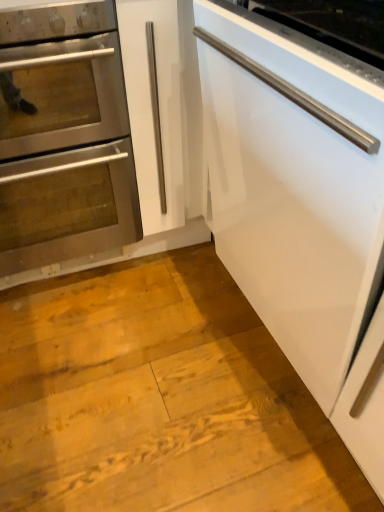
Where is `stainless steel oven at left`? The width and height of the screenshot is (384, 512). stainless steel oven at left is located at coordinates (63, 137).

The image size is (384, 512). What do you see at coordinates (63, 137) in the screenshot?
I see `stainless steel oven at left` at bounding box center [63, 137].

Where is `white glossy dishwasher at right`? This screenshot has height=512, width=384. white glossy dishwasher at right is located at coordinates (301, 206).

The image size is (384, 512). What do you see at coordinates (301, 206) in the screenshot?
I see `white glossy dishwasher at right` at bounding box center [301, 206].

Measure the distance between point (356,248) and camera.

The depth of point (356,248) is 24.69 inches.

Locate an element on the screen. stainless steel oven at left is located at coordinates (63, 137).

Is stainless steel oven at left at the left side of white glossy dishwasher at right?

Yes.

Is the position of stainless steel oven at left less distant than that of white glossy dishwasher at right?

No, it is not.

Which is in front, point (107, 231) or point (268, 120)?

The point (268, 120) is closer to the camera.

From the image's perspective, which object appears higher, stainless steel oven at left or white glossy dishwasher at right?

stainless steel oven at left.

From a real-world perspective, does stainless steel oven at left sit lower than white glossy dishwasher at right?

Indeed, from a real-world perspective, stainless steel oven at left is positioned beneath white glossy dishwasher at right.

Between stainless steel oven at left and white glossy dishwasher at right, which one has larger width?

Wider between the two is stainless steel oven at left.

Is stainless steel oven at left shorter than white glossy dishwasher at right?

Incorrect, the height of stainless steel oven at left does not fall short of that of white glossy dishwasher at right.

Can you confirm if stainless steel oven at left is smaller than white glossy dishwasher at right?

Yes, stainless steel oven at left is smaller than white glossy dishwasher at right.

Is stainless steel oven at left located outside white glossy dishwasher at right?

That's correct, stainless steel oven at left is outside of white glossy dishwasher at right.

Is the surface of stainless steel oven at left in direct contact with white glossy dishwasher at right?

No, stainless steel oven at left is not next to white glossy dishwasher at right.

Is white glossy dishwasher at right at the back of stainless steel oven at left?

No.

How many degrees apart are the facing directions of stainless steel oven at left and white glossy dishwasher at right?

stainless steel oven at left and white glossy dishwasher at right are facing 90 degrees away from each other.

This screenshot has width=384, height=512. I want to click on oven lying behind the white glossy dishwasher at right, so click(63, 137).

Does white glossy dishwasher at right appear on the right side of stainless steel oven at left?

Indeed, white glossy dishwasher at right is positioned on the right side of stainless steel oven at left.

Which object is further away from the camera, white glossy dishwasher at right or stainless steel oven at left?

stainless steel oven at left.

Which is farther, (x=256, y=302) or (x=82, y=179)?

Positioned behind is point (x=82, y=179).

From the image's perspective, does white glossy dishwasher at right appear lower than stainless steel oven at left?

Indeed, from the image's perspective, white glossy dishwasher at right is shown beneath stainless steel oven at left.

From a real-world perspective, does white glossy dishwasher at right stand above stainless steel oven at left?

Indeed, from a real-world perspective, white glossy dishwasher at right stands above stainless steel oven at left.

Considering the relative sizes of white glossy dishwasher at right and stainless steel oven at left in the image provided, is white glossy dishwasher at right thinner than stainless steel oven at left?

Correct, the width of white glossy dishwasher at right is less than that of stainless steel oven at left.

Is white glossy dishwasher at right taller than stainless steel oven at left?

Incorrect, the height of white glossy dishwasher at right is not larger of that of stainless steel oven at left.

Is white glossy dishwasher at right bigger or smaller than stainless steel oven at left?

Clearly, white glossy dishwasher at right is larger in size than stainless steel oven at left.

Is white glossy dishwasher at right positioned beyond the bounds of stainless steel oven at left?

Indeed, white glossy dishwasher at right is completely outside stainless steel oven at left.

Is white glossy dishwasher at right far away from stainless steel oven at left?

white glossy dishwasher at right is actually quite close to stainless steel oven at left.

Could you tell me if white glossy dishwasher at right is facing stainless steel oven at left?

No, white glossy dishwasher at right is not facing towards stainless steel oven at left.

Can you tell me how much white glossy dishwasher at right and stainless steel oven at left differ in facing direction?

The facing directions of white glossy dishwasher at right and stainless steel oven at left are 90 degrees apart.

What are the coordinates of `cabinetry that is in front of the stainless steel oven at left` in the screenshot? It's located at (301, 206).

At what (x,y) coordinates should I click in order to perform the action: click on cabinetry to the right of stainless steel oven at left. Please return your answer as a coordinate pair (x, y). Looking at the image, I should click on (301, 206).

Locate an element on the screen. oven that appears above the white glossy dishwasher at right (from the image's perspective) is located at coordinates (63, 137).